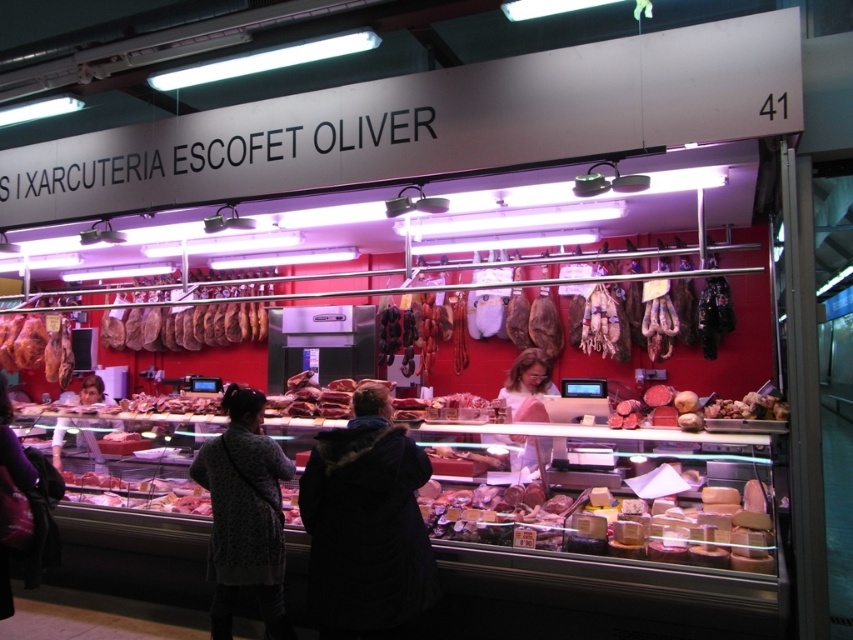
Question: Which of the following is the closest to the observer?

Choices:
 (A) matte brown ham at left
 (B) dark gray textured coat at lower left
 (C) shiny brown cheese at center

Answer: (C)

Question: Which point appears closest to the camera in this image?

Choices:
 (A) (28, 312)
 (B) (85, 381)

Answer: (B)

Question: Can you confirm if dark blue coat at center is bigger than matte brown ham at left?

Choices:
 (A) yes
 (B) no

Answer: (B)

Question: Which of the following is the closest to the observer?

Choices:
 (A) (97, 380)
 (B) (279, 492)

Answer: (B)

Question: Can you confirm if smooth pink meat at center is wider than shiny brown cheese at center?

Choices:
 (A) no
 (B) yes

Answer: (B)

Question: Does white cheese at center appear on the left side of brown leather meat at center?

Choices:
 (A) yes
 (B) no

Answer: (B)